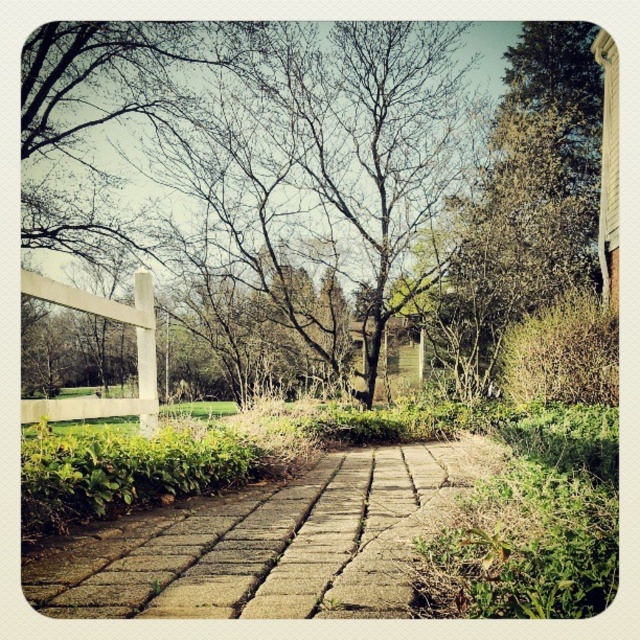
Question: Where is bare branches at center located in relation to white wooden fence at left in the image?

Choices:
 (A) below
 (B) above

Answer: (B)

Question: Is the position of bare branches at center more distant than that of white wooden fence at left?

Choices:
 (A) no
 (B) yes

Answer: (A)

Question: Does brown stone path at center have a lesser width compared to white wooden fence at left?

Choices:
 (A) no
 (B) yes

Answer: (A)

Question: Which object appears farthest from the camera in this image?

Choices:
 (A) brown stone path at center
 (B) bare branches at center

Answer: (B)

Question: Among these objects, which one is farthest from the camera?

Choices:
 (A) white wooden fence at left
 (B) bare branches at center

Answer: (A)

Question: Which object is farther from the camera taking this photo?

Choices:
 (A) white wooden fence at left
 (B) bare branches at center

Answer: (A)